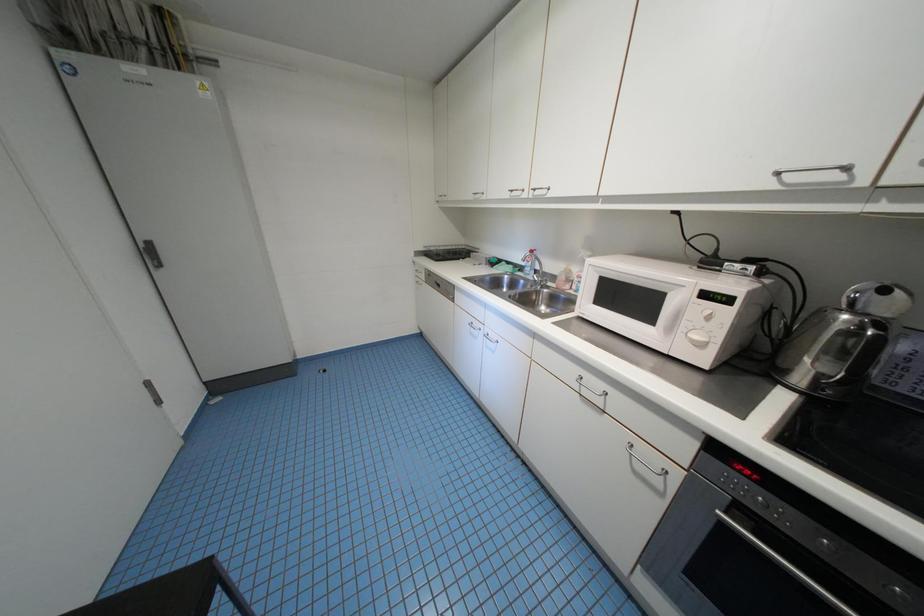
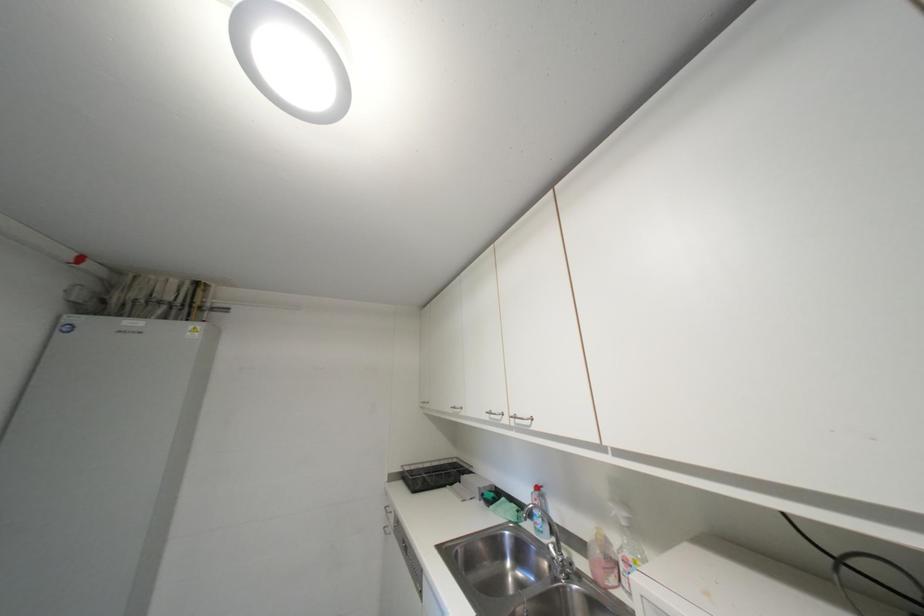
Question: Based on the continuous images, in which direction is the camera rotating? Reply with the corresponding letter.

Choices:
 (A) Left
 (B) Right
 (C) Up
 (D) Down

Answer: (C)